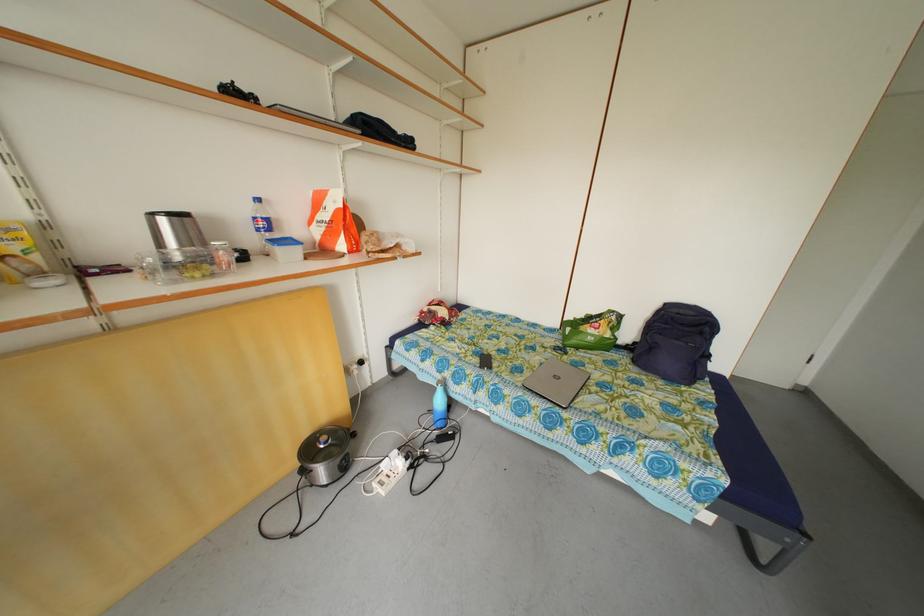
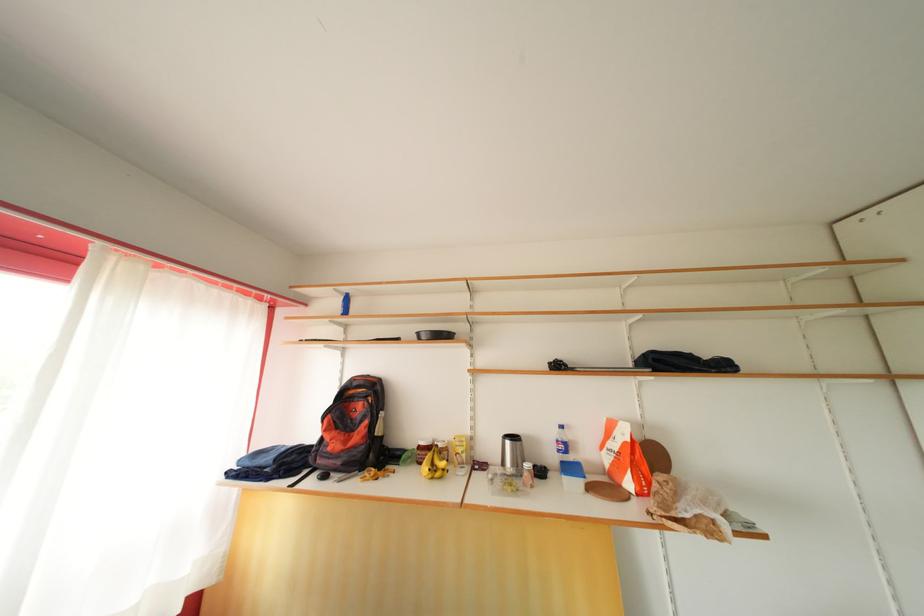
In the second image, find the point that corresponds to (270,230) in the first image.

(568, 453)